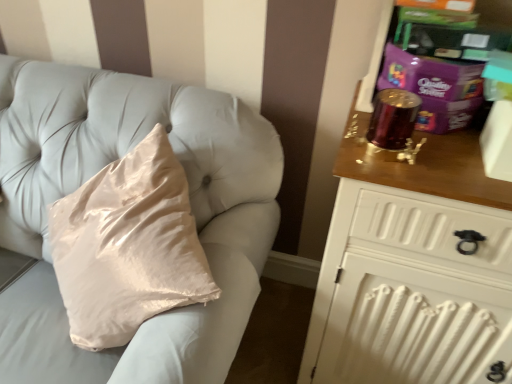
Locate an element on the screen. This screenshot has width=512, height=384. wooden chest of drawers at right is located at coordinates (412, 268).

Describe the element at coordinates (412, 268) in the screenshot. Image resolution: width=512 pixels, height=384 pixels. I see `wooden chest of drawers at right` at that location.

Measure the distance between wooden chest of drawers at right and camera.

The distance of wooden chest of drawers at right from camera is 28.65 inches.

Measure the distance between silky beige pillow at upper left and camera.

silky beige pillow at upper left is 28.91 inches away from camera.

You are a GUI agent. You are given a task and a screenshot of the screen. Output one action in this format:
    pyautogui.click(x=<x>, y=<y>)
    Task: Click on the silky beige pillow at upper left
    
    Given the screenshot: What is the action you would take?
    pyautogui.click(x=95, y=173)

Measure the distance between point (16, 172) and camera.

Point (16, 172) is 3.94 feet away from camera.

Image resolution: width=512 pixels, height=384 pixels. What do you see at coordinates (95, 173) in the screenshot? I see `silky beige pillow at upper left` at bounding box center [95, 173].

Identify the location of wooden chest of drawers at right. (412, 268).

Considering the relative positions of wooden chest of drawers at right and silky beige pillow at upper left in the image provided, is wooden chest of drawers at right to the right of silky beige pillow at upper left from the viewer's perspective?

Yes, wooden chest of drawers at right is to the right of silky beige pillow at upper left.

Is wooden chest of drawers at right positioned before silky beige pillow at upper left?

Yes.

Which is farther, (x=413, y=351) or (x=242, y=190)?

The point (x=242, y=190) is farther from the camera.

From the image's perspective, which one is positioned lower, wooden chest of drawers at right or silky beige pillow at upper left?

wooden chest of drawers at right, from the image's perspective.

From a real-world perspective, relative to silky beige pillow at upper left, is wooden chest of drawers at right vertically above or below?

wooden chest of drawers at right is situated higher than silky beige pillow at upper left in the real world.

Consider the image. Considering the relative sizes of wooden chest of drawers at right and silky beige pillow at upper left in the image provided, is wooden chest of drawers at right thinner than silky beige pillow at upper left?

No, wooden chest of drawers at right is not thinner than silky beige pillow at upper left.

Is wooden chest of drawers at right taller or shorter than silky beige pillow at upper left?

In the image, wooden chest of drawers at right appears to be taller than silky beige pillow at upper left.

Considering the relative sizes of wooden chest of drawers at right and silky beige pillow at upper left in the image provided, is wooden chest of drawers at right bigger than silky beige pillow at upper left?

Correct, wooden chest of drawers at right is larger in size than silky beige pillow at upper left.

Choose the correct answer: Is wooden chest of drawers at right inside silky beige pillow at upper left or outside it?

wooden chest of drawers at right is not enclosed by silky beige pillow at upper left.

Is wooden chest of drawers at right not close to silky beige pillow at upper left?

wooden chest of drawers at right is actually quite close to silky beige pillow at upper left.

Is silky beige pillow at upper left at the back of wooden chest of drawers at right?

wooden chest of drawers at right is not turned away from silky beige pillow at upper left.

How many degrees apart are the facing directions of wooden chest of drawers at right and silky beige pillow at upper left?

27.2 degrees.

How much distance is there between wooden chest of drawers at right and silky beige pillow at upper left?

wooden chest of drawers at right is 18.61 inches from silky beige pillow at upper left.

The width and height of the screenshot is (512, 384). I want to click on chest of drawers lying on the right of silky beige pillow at upper left, so click(x=412, y=268).

Would you say silky beige pillow at upper left is to the left or to the right of wooden chest of drawers at right in the picture?

silky beige pillow at upper left is to the left of wooden chest of drawers at right.

In the image, is silky beige pillow at upper left positioned in front of or behind wooden chest of drawers at right?

silky beige pillow at upper left is positioned farther from the viewer than wooden chest of drawers at right.

Between point (6, 233) and point (485, 372), which one is positioned in front?

The point (485, 372) is closer.

From the image's perspective, between silky beige pillow at upper left and wooden chest of drawers at right, who is located below?

wooden chest of drawers at right, from the image's perspective.

From a real-world perspective, is silky beige pillow at upper left physically located above or below wooden chest of drawers at right?

From a real-world perspective, silky beige pillow at upper left is physically below wooden chest of drawers at right.

Considering the sizes of silky beige pillow at upper left and wooden chest of drawers at right in the image, is silky beige pillow at upper left wider or thinner than wooden chest of drawers at right?

In the image, silky beige pillow at upper left appears to be more narrow than wooden chest of drawers at right.

Which of these two, silky beige pillow at upper left or wooden chest of drawers at right, stands shorter?

silky beige pillow at upper left.

Considering the sizes of objects silky beige pillow at upper left and wooden chest of drawers at right in the image provided, who is smaller, silky beige pillow at upper left or wooden chest of drawers at right?

With smaller size is silky beige pillow at upper left.

Is silky beige pillow at upper left located outside wooden chest of drawers at right?

silky beige pillow at upper left lies outside wooden chest of drawers at right's area.

Is silky beige pillow at upper left not close to wooden chest of drawers at right?

That's not correct — silky beige pillow at upper left is a little close to wooden chest of drawers at right.

Is silky beige pillow at upper left looking in the opposite direction of wooden chest of drawers at right?

No, silky beige pillow at upper left's orientation is not away from wooden chest of drawers at right.

Find the location of a particular element. Image resolution: width=512 pixels, height=384 pixels. furniture that appears on the left of wooden chest of drawers at right is located at coordinates (95, 173).

Where is `furniture behind the wooden chest of drawers at right`? The height and width of the screenshot is (384, 512). furniture behind the wooden chest of drawers at right is located at coordinates (95, 173).

Locate an element on the screen. furniture to the left of wooden chest of drawers at right is located at coordinates (95, 173).